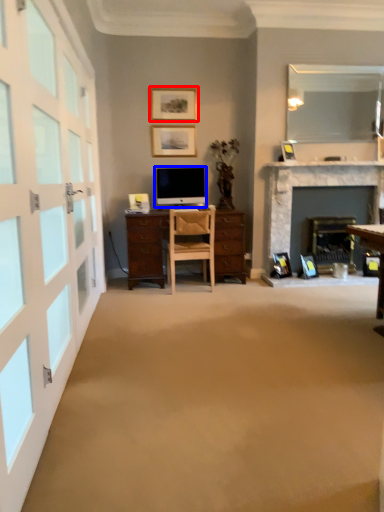
Question: Which point is further to the camera, picture frame (highlighted by a red box) or television (highlighted by a blue box)?

Choices:
 (A) picture frame
 (B) television

Answer: (A)